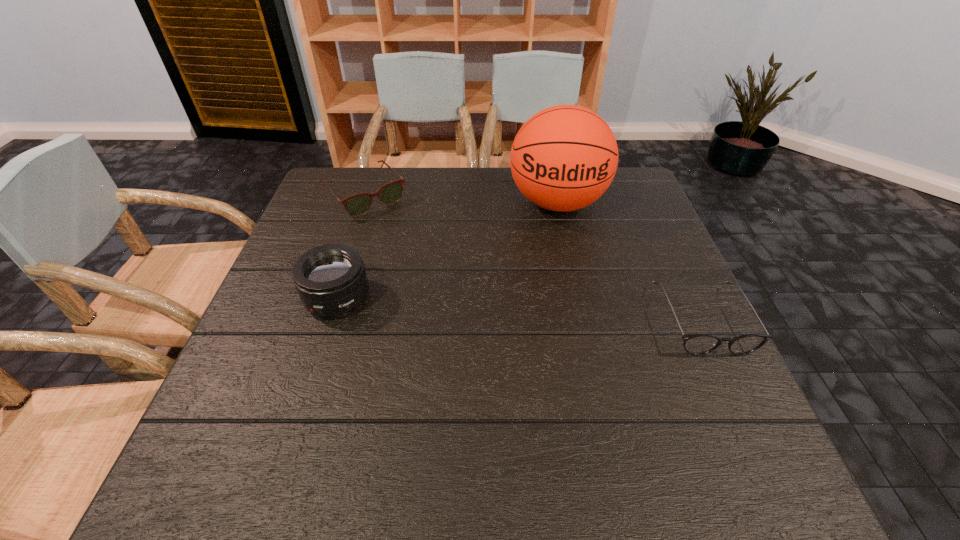
Locate an element on the screen. vacant area situated 0.070m at the front view of the farther spectacles is located at coordinates (396, 229).

This screenshot has height=540, width=960. Find the location of `free space located on the side with logo of the second object from right to left`. free space located on the side with logo of the second object from right to left is located at coordinates (559, 274).

Identify the location of free space located on the side with logo of the second object from right to left. The image size is (960, 540). (560, 292).

The width and height of the screenshot is (960, 540). Identify the location of vacant space situated on the side with logo of the second object from right to left. (559, 245).

You are a GUI agent. You are given a task and a screenshot of the screen. Output one action in this format:
    pyautogui.click(x=<x>, y=<y>)
    Task: Click on the spectacles that is positioned at the far edge
    This screenshot has height=540, width=960.
    Given the screenshot: What is the action you would take?
    pyautogui.click(x=358, y=204)

This screenshot has width=960, height=540. Identify the location of basketball that is at the far edge. (563, 158).

Where is `telephoto lens positioned at the left edge`? telephoto lens positioned at the left edge is located at coordinates (331, 280).

I want to click on spectacles located at the left edge, so click(358, 204).

What are the coordinates of `spectacles that is at the right edge` in the screenshot? It's located at (697, 344).

You are a GUI agent. You are given a task and a screenshot of the screen. Output one action in this format:
    pyautogui.click(x=<x>, y=<y>)
    Task: Click on the basketball positioned at the right edge
    
    Given the screenshot: What is the action you would take?
    pyautogui.click(x=563, y=158)